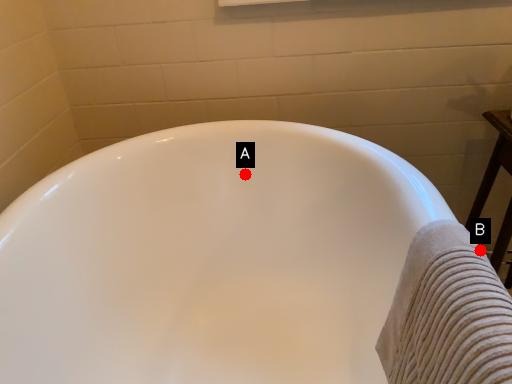
Question: Two points are circled on the image, labeled by A and B beside each circle. Which point is farther from the camera taking this photo?

Choices:
 (A) A is further
 (B) B is further

Answer: (A)